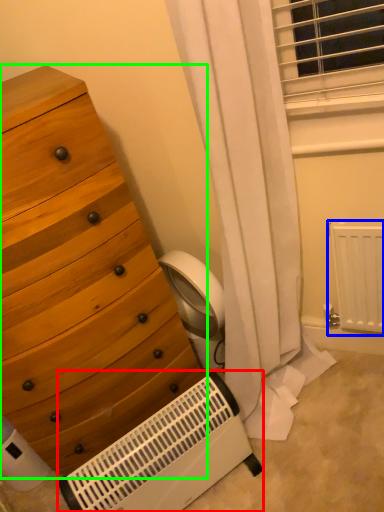
Question: Considering the real-world distances, which object is farthest from heater (highlighted by a red box)? radiator (highlighted by a blue box) or chest of drawers (highlighted by a green box)?

Choices:
 (A) radiator
 (B) chest of drawers

Answer: (A)